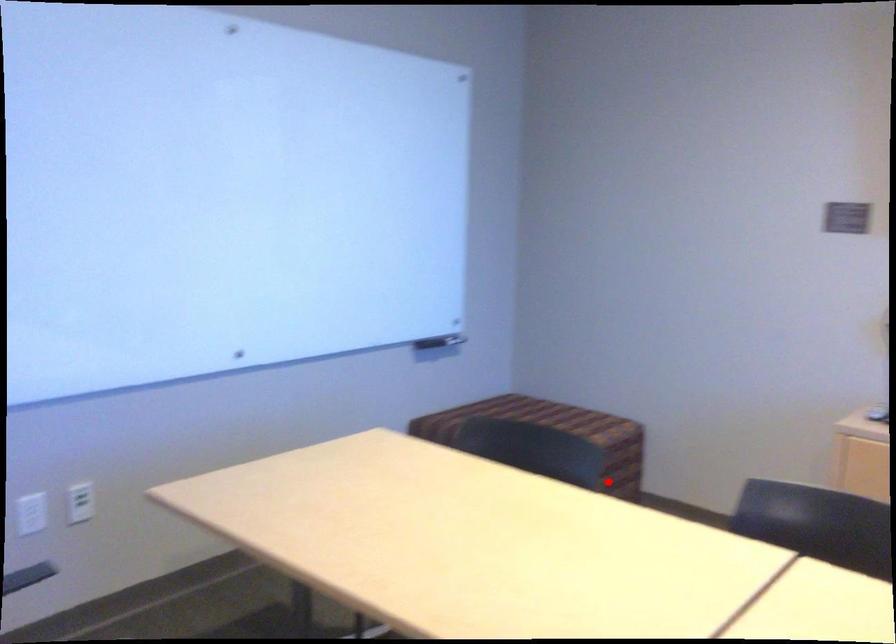
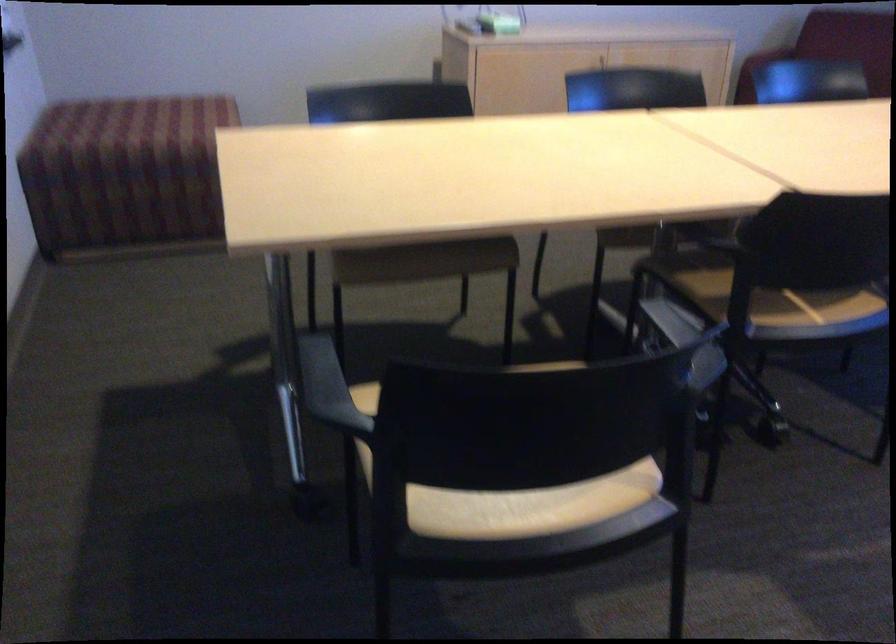
Question: I am providing you with two images of the same scene from different viewpoints. A red point is marked on the first image. Is the red point's position out of view in image 2?

Choices:
 (A) Yes
 (B) No

Answer: (A)